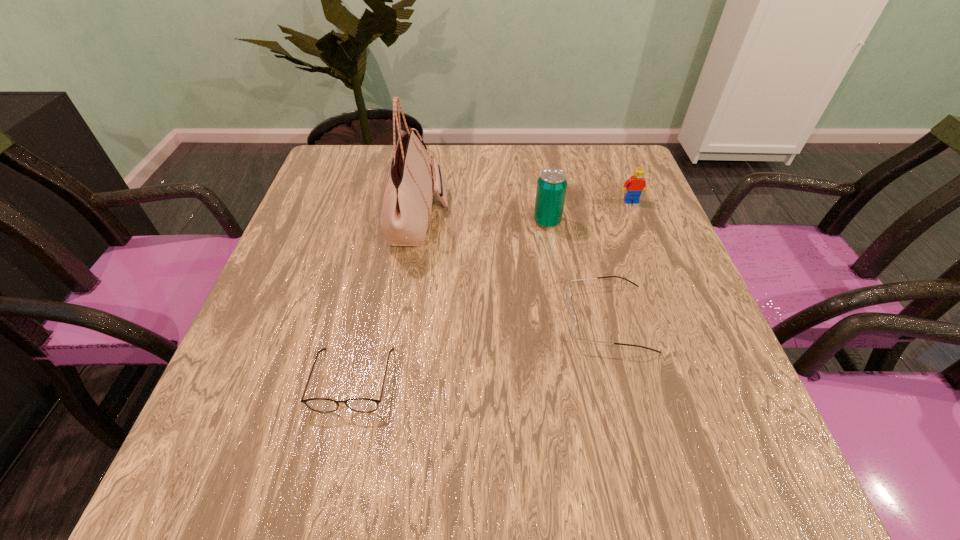
What are the coordinates of `vacant space that satisfies the following two spatial constraints: 1. on the side of the tallest object with the attached pouch; 2. on the left side of the fourth shortest object` in the screenshot? It's located at (418, 221).

At what (x,y) coordinates should I click in order to perform the action: click on vacant point that satisfies the following two spatial constraints: 1. on the side of the tallest object with the attached pouch; 2. on the front-facing side of the shorter spectacles. Please return your answer as a coordinate pair (x, y). Looking at the image, I should click on (394, 380).

Locate an element on the screen. vacant space that satisfies the following two spatial constraints: 1. on the side of the handbag with the attached pouch; 2. on the right side of the second tallest object is located at coordinates (418, 221).

The height and width of the screenshot is (540, 960). I want to click on blank area in the image that satisfies the following two spatial constraints: 1. through the lenses of the right spectacles; 2. on the front-facing side of the shortest object, so click(623, 380).